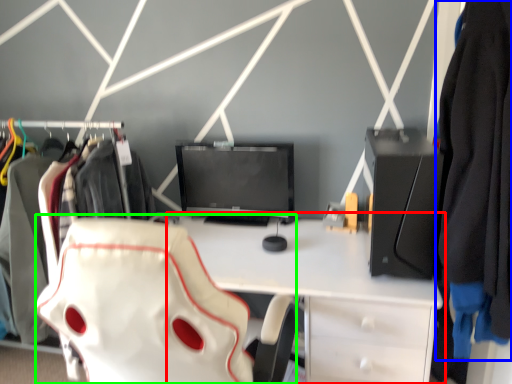
Question: Which object is positioned farthest from desk (highlighted by a red box)? Select from clothing (highlighted by a blue box) and swivel chair (highlighted by a green box).

Choices:
 (A) clothing
 (B) swivel chair

Answer: (A)